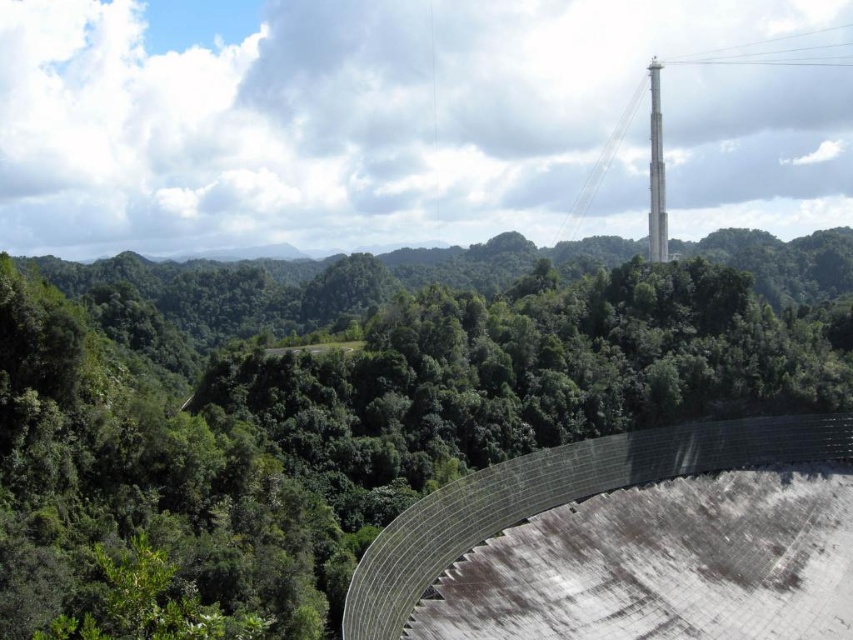
Can you confirm if green leafy forest at center is bigger than metallic gray dam at center?

Indeed, green leafy forest at center has a larger size compared to metallic gray dam at center.

Is green leafy forest at center above metallic gray dam at center?

Correct, green leafy forest at center is located above metallic gray dam at center.

Between point (160, 288) and point (517, 502), which one is positioned in front?

Positioned in front is point (517, 502).

The height and width of the screenshot is (640, 853). I want to click on green leafy forest at center, so click(x=378, y=387).